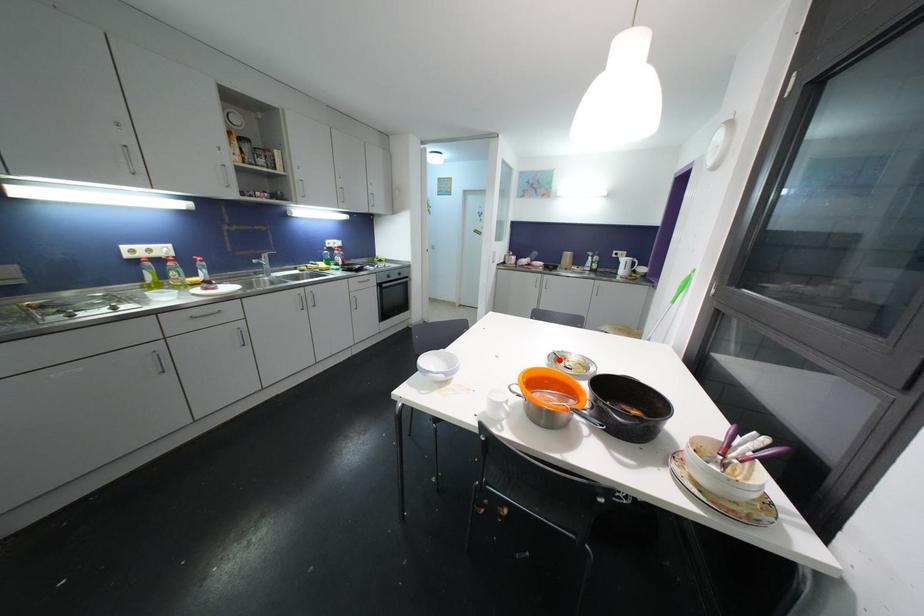
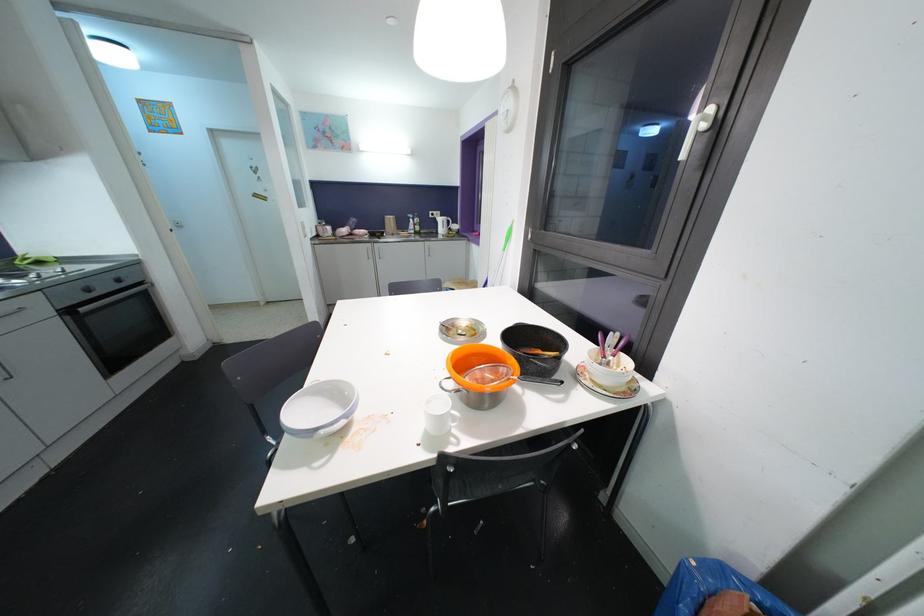
Locate, in the second image, the point that corresponds to the highlighted location in the first image.

(451, 331)